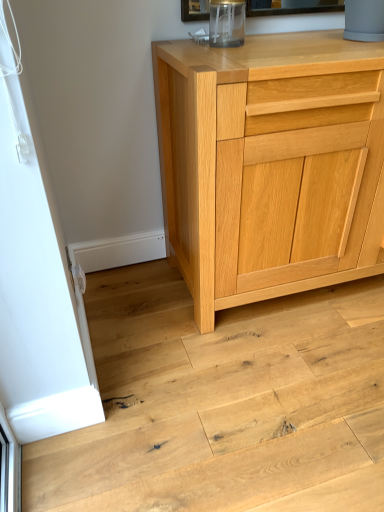
I want to click on vacant area that is in front of natural wood cabinet at center, so click(x=278, y=386).